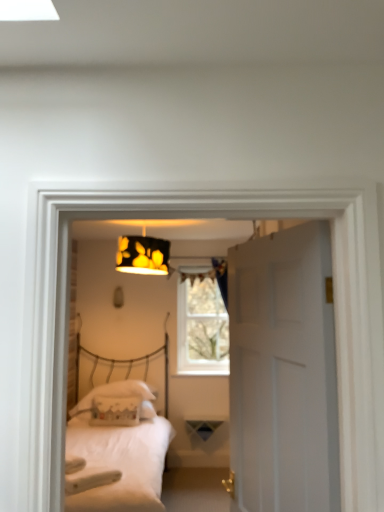
Question: Does white fabric pillow at center, marked as the second pillow in a front-to-back arrangement, have a greater height compared to black paper lampshade at upper center?

Choices:
 (A) yes
 (B) no

Answer: (B)

Question: From a real-world perspective, is white fabric pillow at center, marked as the second pillow in a front-to-back arrangement, over black paper lampshade at upper center?

Choices:
 (A) yes
 (B) no

Answer: (B)

Question: Are white fabric pillow at center, the 1th pillow when ordered from back to front, and black paper lampshade at upper center located far from each other?

Choices:
 (A) no
 (B) yes

Answer: (B)

Question: Is white fabric pillow at center, marked as the second pillow in a front-to-back arrangement, located outside black paper lampshade at upper center?

Choices:
 (A) yes
 (B) no

Answer: (A)

Question: Is white fabric pillow at center, the 1th pillow when ordered from back to front, in front of black paper lampshade at upper center?

Choices:
 (A) yes
 (B) no

Answer: (B)

Question: Can black paper lampshade at upper center be found inside white fabric pillow at center, the 1th pillow when ordered from back to front?

Choices:
 (A) no
 (B) yes

Answer: (A)

Question: Does white fabric pillow at center, the 1th pillow when ordered from back to front, come behind white matte bed at center?

Choices:
 (A) no
 (B) yes

Answer: (B)

Question: Is white fabric pillow at center, the 1th pillow when ordered from back to front, positioned far away from white matte bed at center?

Choices:
 (A) yes
 (B) no

Answer: (B)

Question: From the image's perspective, is white fabric pillow at center, the 1th pillow when ordered from back to front, above white matte bed at center?

Choices:
 (A) no
 (B) yes

Answer: (A)

Question: Is white fabric pillow at center, marked as the second pillow in a front-to-back arrangement, shorter than white matte bed at center?

Choices:
 (A) no
 (B) yes

Answer: (B)

Question: Is white matte bed at center completely or partially inside white fabric pillow at center, the 1th pillow when ordered from back to front?

Choices:
 (A) no
 (B) yes

Answer: (A)

Question: Is white fabric pillow at center, marked as the second pillow in a front-to-back arrangement, at the left side of white matte bed at center?

Choices:
 (A) no
 (B) yes

Answer: (B)

Question: Can you see white fabric pillow at center, the first pillow from the front, touching white matte door at center?

Choices:
 (A) no
 (B) yes

Answer: (A)